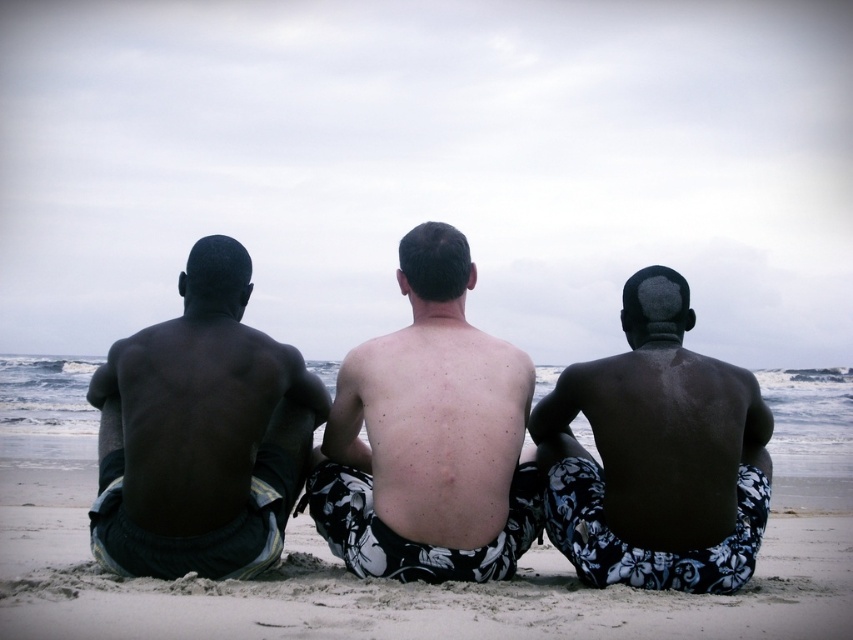
Question: Is smooth skin back at center bigger than dark skin man at left?

Choices:
 (A) no
 (B) yes

Answer: (A)

Question: Does dark skin man at left lie in front of dark skin textured shorts at center?

Choices:
 (A) no
 (B) yes

Answer: (B)

Question: Which point is farther from the camera taking this photo?

Choices:
 (A) (268, 445)
 (B) (416, 532)
 (C) (762, 518)

Answer: (A)

Question: Estimate the real-world distances between objects in this image. Which object is farther from the dark skin textured shorts at center?

Choices:
 (A) smooth skin back at center
 (B) sandy beach at center

Answer: (B)

Question: Which point is closer to the camera?

Choices:
 (A) smooth skin back at center
 (B) sandy beach at center

Answer: (B)

Question: Does smooth skin back at center appear under dark skin textured shorts at center?

Choices:
 (A) yes
 (B) no

Answer: (B)